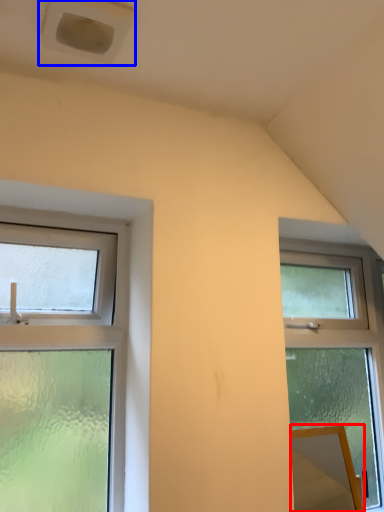
Question: Which of the following is the closest to the observer, mirror (highlighted by a red box) or air conditioning (highlighted by a blue box)?

Choices:
 (A) mirror
 (B) air conditioning

Answer: (B)